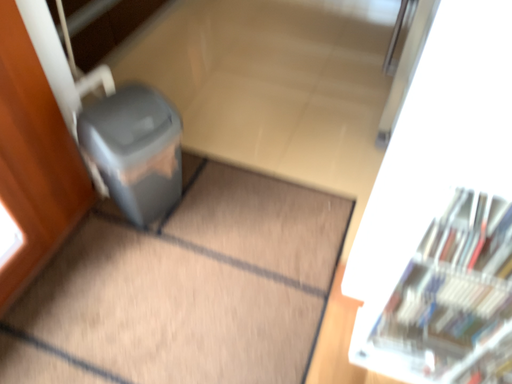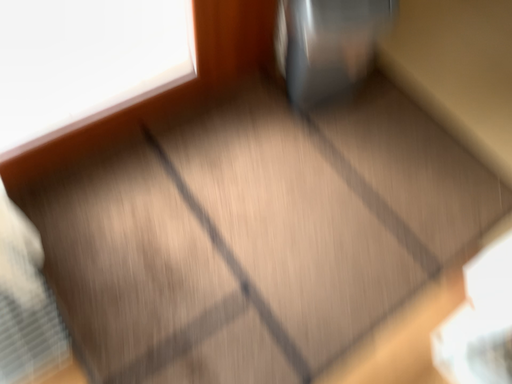
Question: How did the camera likely rotate when shooting the video?

Choices:
 (A) rotated right
 (B) rotated left

Answer: (B)